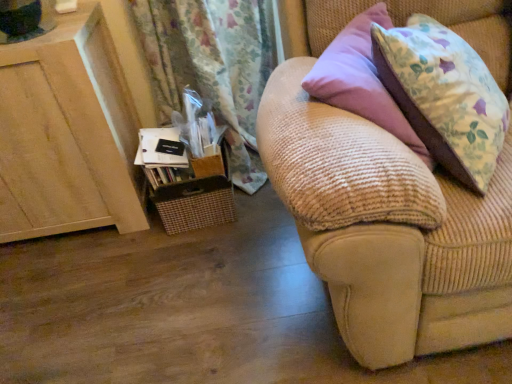
Question: Is beige corduroy couch at right further to the viewer compared to wooden cabinet at left?

Choices:
 (A) yes
 (B) no

Answer: (B)

Question: Is beige corduroy couch at right smaller than wooden cabinet at left?

Choices:
 (A) no
 (B) yes

Answer: (A)

Question: From a real-world perspective, is beige corduroy couch at right below wooden cabinet at left?

Choices:
 (A) no
 (B) yes

Answer: (A)

Question: Can you confirm if beige corduroy couch at right is positioned to the left of wooden cabinet at left?

Choices:
 (A) no
 (B) yes

Answer: (A)

Question: Does beige corduroy couch at right turn towards wooden cabinet at left?

Choices:
 (A) no
 (B) yes

Answer: (A)

Question: Considering the relative sizes of beige corduroy couch at right and wooden cabinet at left in the image provided, is beige corduroy couch at right taller than wooden cabinet at left?

Choices:
 (A) yes
 (B) no

Answer: (A)

Question: Does wooden cabinet at left have a larger size compared to beige corduroy couch at right?

Choices:
 (A) no
 (B) yes

Answer: (A)

Question: From the image's perspective, is wooden cabinet at left beneath beige corduroy couch at right?

Choices:
 (A) no
 (B) yes

Answer: (B)

Question: Does wooden cabinet at left have a greater height compared to beige corduroy couch at right?

Choices:
 (A) yes
 (B) no

Answer: (B)

Question: Is wooden cabinet at left facing towards beige corduroy couch at right?

Choices:
 (A) no
 (B) yes

Answer: (A)

Question: Is wooden cabinet at left to the left of beige corduroy couch at right from the viewer's perspective?

Choices:
 (A) no
 (B) yes

Answer: (B)

Question: Can you confirm if wooden cabinet at left is smaller than beige corduroy couch at right?

Choices:
 (A) yes
 (B) no

Answer: (A)

Question: Is point (316, 236) positioned closer to the camera than point (78, 173)?

Choices:
 (A) closer
 (B) farther

Answer: (A)